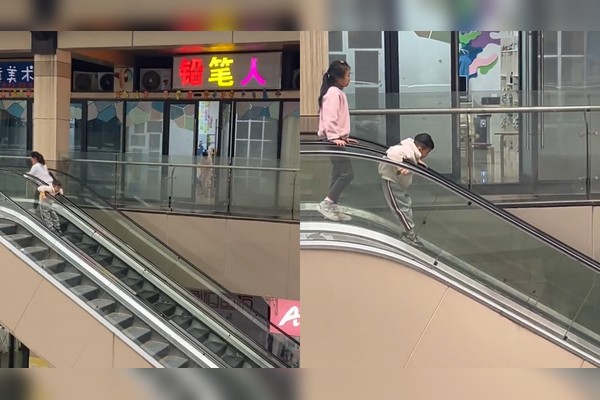
Locate an element on the screen. The width and height of the screenshot is (600, 400). doorway is located at coordinates (495, 73), (441, 68), (213, 133), (184, 134).